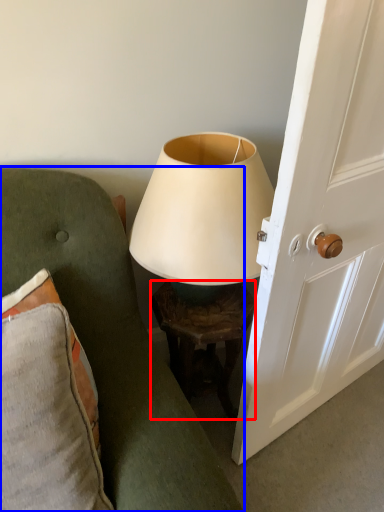
Question: Which of the following is the farthest to the observer, table (highlighted by a red box) or furniture (highlighted by a blue box)?

Choices:
 (A) table
 (B) furniture

Answer: (A)